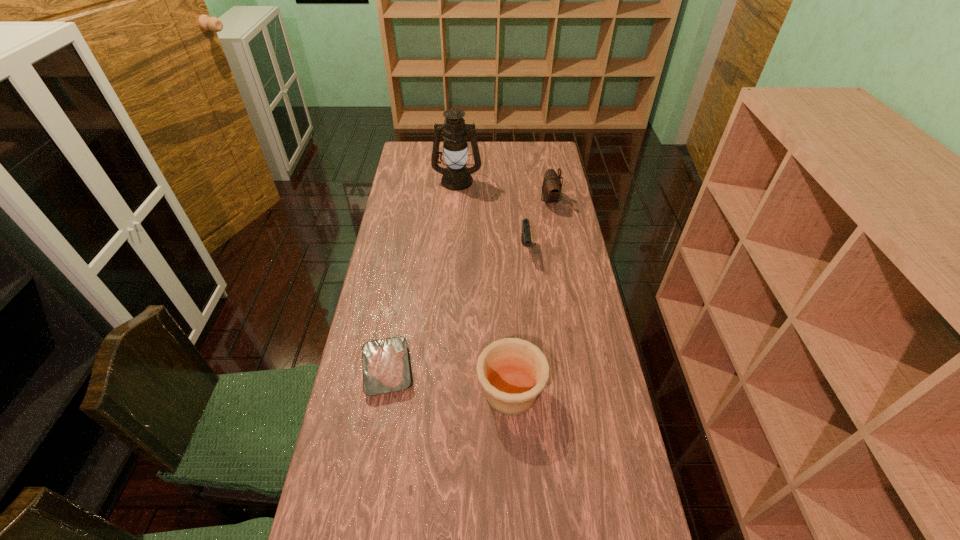
Find the location of a particular element. The height and width of the screenshot is (540, 960). oil lamp is located at coordinates coord(456,176).

You are a GUI agent. You are given a task and a screenshot of the screen. Output one action in this format:
    pyautogui.click(x=<x>, y=<y>)
    Task: Click on the rightmost object
    
    Given the screenshot: What is the action you would take?
    pyautogui.click(x=551, y=189)

The height and width of the screenshot is (540, 960). I want to click on pottery, so click(x=513, y=372).

Identify the location of pistol. The height and width of the screenshot is (540, 960). (526, 235).

Identify the location of the third nearest object. The image size is (960, 540). (526, 235).

Locate an element on the screen. This screenshot has width=960, height=540. steak is located at coordinates (386, 369).

This screenshot has width=960, height=540. I want to click on vacant space situated on the back of the oil lamp, so click(x=460, y=142).

I want to click on blank space located 0.190m with the flap open on the pouch, so click(x=495, y=200).

What are the coordinates of `vacant space positioned with the flap open on the pouch` in the screenshot? It's located at (446, 200).

At what (x,y) coordinates should I click in order to perform the action: click on free space located 0.180m with the flap open on the pouch. Please return your answer as a coordinate pair (x, y). Looking at the image, I should click on (498, 200).